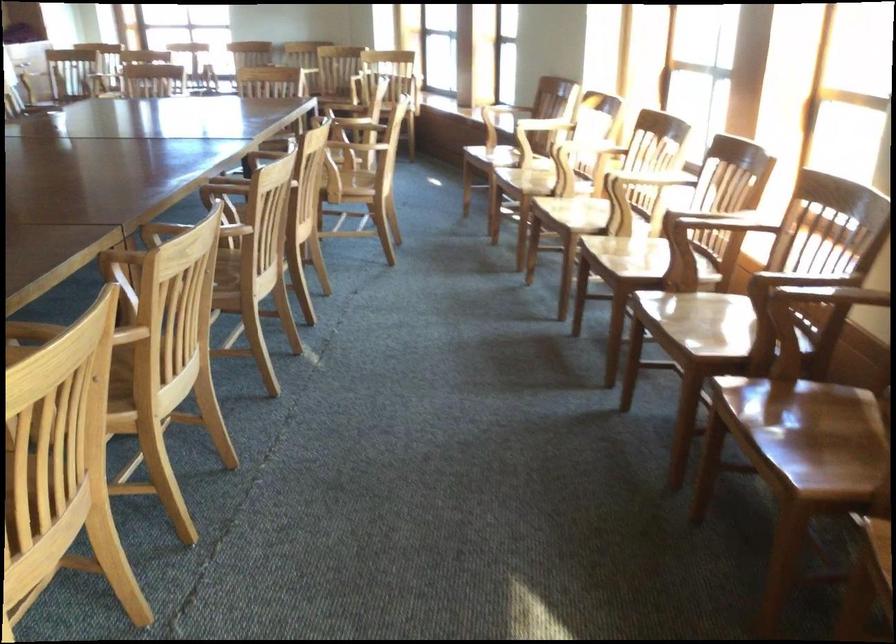
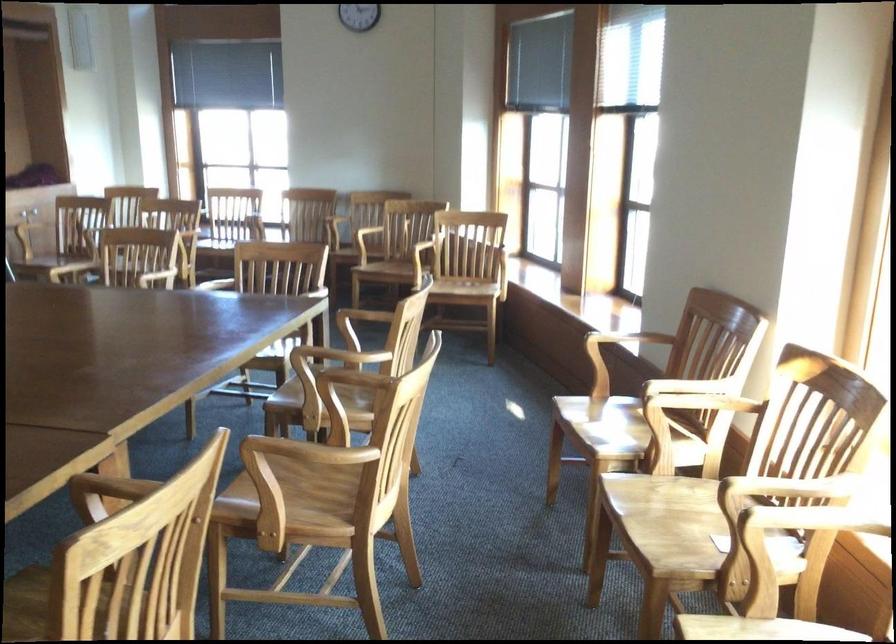
Find the pixel in the second image that matches pixel 339 120 in the first image.

(337, 357)